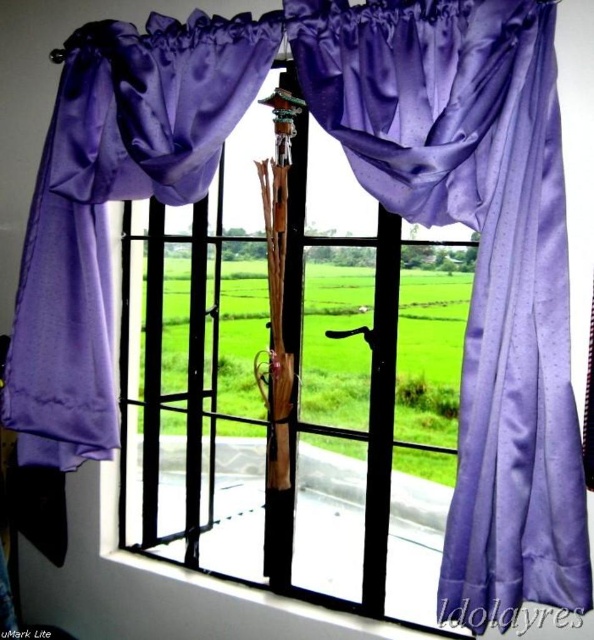
You are standing in a room with a window view of a rice field. You see a satin purple umbrella at center and a satin purple curtain at center. Which object is closer to you?

The satin purple umbrella at center is closer to you than the satin purple curtain at center.